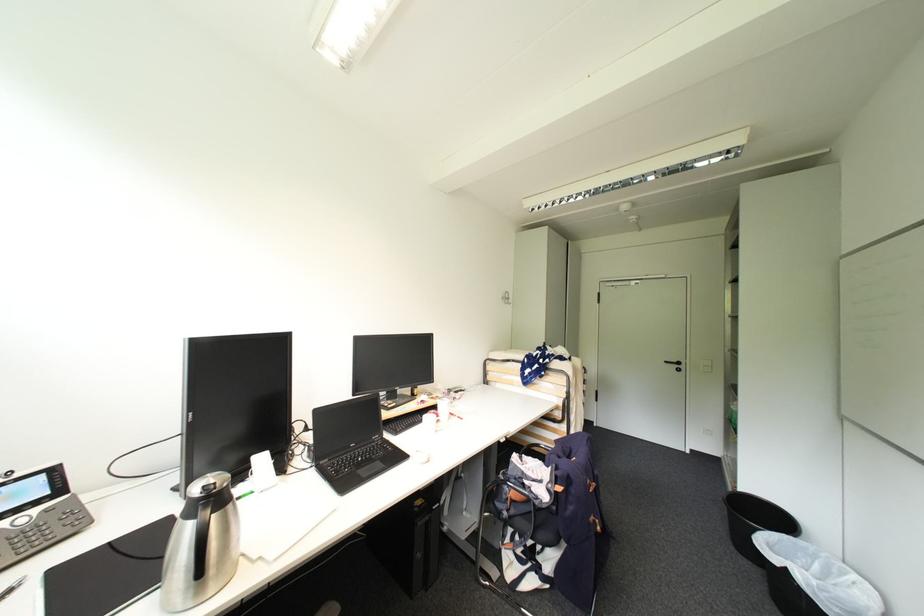
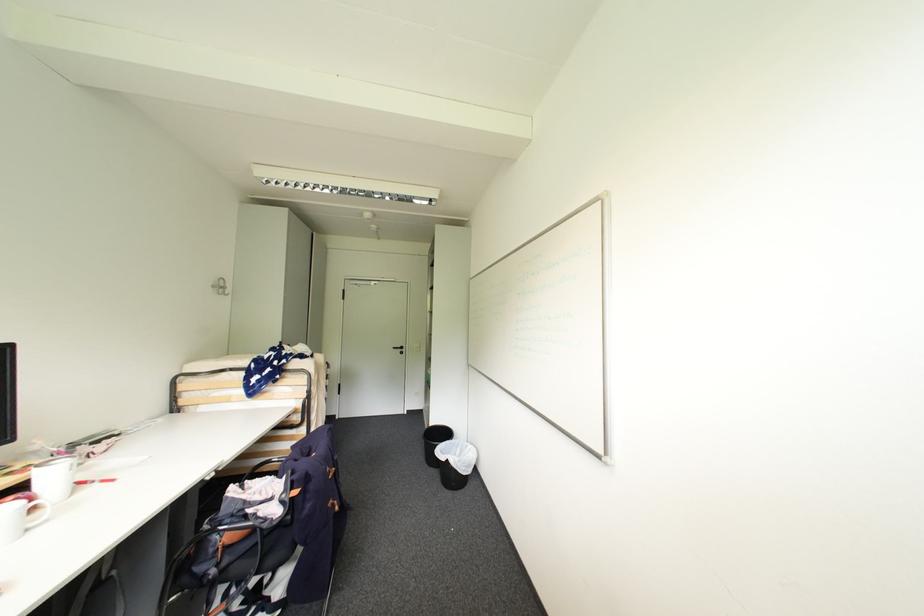
Find the pixel in the second image that matches point (508, 299) in the first image.

(220, 286)